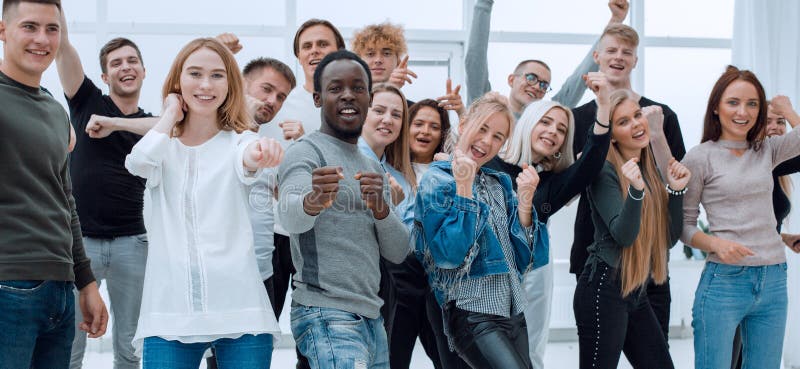
Identify the location of window panes. The height and width of the screenshot is (369, 800). (690, 79), (701, 25), (572, 54), (416, 15), (232, 14), (262, 45), (84, 12), (88, 48).